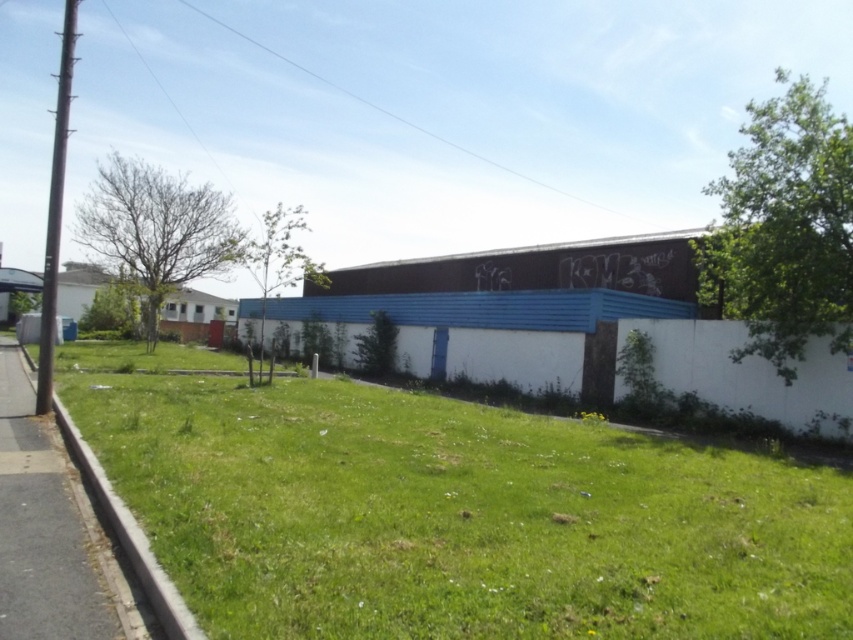
Question: Does green grassy at lower left appear over gray asphalt pavement at lower left?

Choices:
 (A) no
 (B) yes

Answer: (A)

Question: From the image, what is the correct spatial relationship of green grassy at lower left in relation to gray asphalt pavement at lower left?

Choices:
 (A) below
 (B) above

Answer: (A)

Question: Does green grassy at lower left have a lesser width compared to gray asphalt pavement at lower left?

Choices:
 (A) no
 (B) yes

Answer: (A)

Question: Which point is farther to the camera?

Choices:
 (A) green grassy at lower left
 (B) gray asphalt pavement at lower left

Answer: (B)